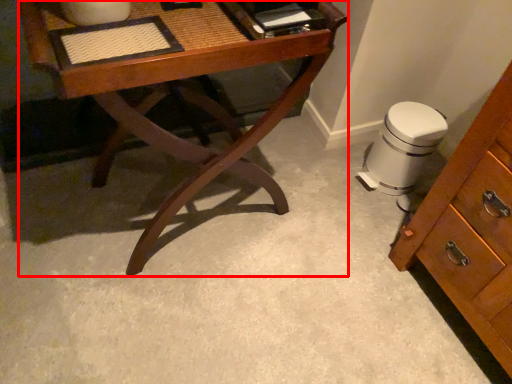
Question: Observing the image, what is the correct spatial positioning of desk (annotated by the red box) in reference to swivel chair?

Choices:
 (A) left
 (B) right

Answer: (A)